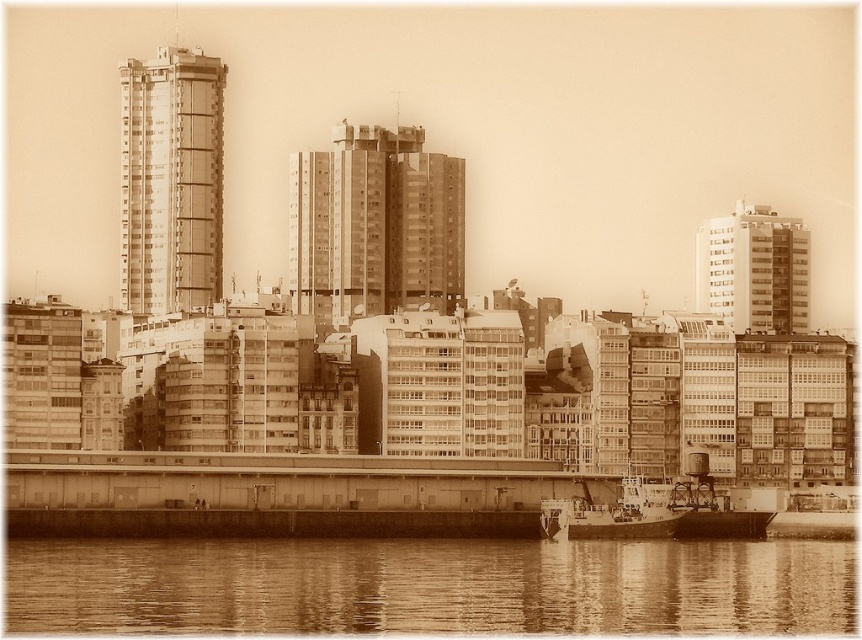
Does smooth concrete building at right have a greater width compared to metallic ship at lower center?

Indeed, smooth concrete building at right has a greater width compared to metallic ship at lower center.

Which is more to the right, smooth concrete building at right or metallic ship at lower center?

smooth concrete building at right is more to the right.

Locate an element on the screen. The height and width of the screenshot is (640, 862). smooth concrete building at right is located at coordinates (754, 269).

Who is lower down, smooth concrete building at left or smooth concrete building at right?

smooth concrete building at right is lower down.

Is point (198, 182) positioned after point (716, 308)?

No, it is in front of (716, 308).

Which is in front, point (182, 189) or point (750, 314)?

Point (182, 189) is in front.

You are a GUI agent. You are given a task and a screenshot of the screen. Output one action in this format:
    pyautogui.click(x=<x>, y=<y>)
    Task: Click on the smooth concrete building at left
    The width and height of the screenshot is (862, 640).
    Given the screenshot: What is the action you would take?
    pyautogui.click(x=172, y=180)

Between metallic ship at lower center and metallic gray boat at lower right, which one is positioned higher?

metallic gray boat at lower right

Can you confirm if metallic ship at lower center is shorter than metallic gray boat at lower right?

Yes.

Find the location of a particular element. The width and height of the screenshot is (862, 640). metallic ship at lower center is located at coordinates (616, 513).